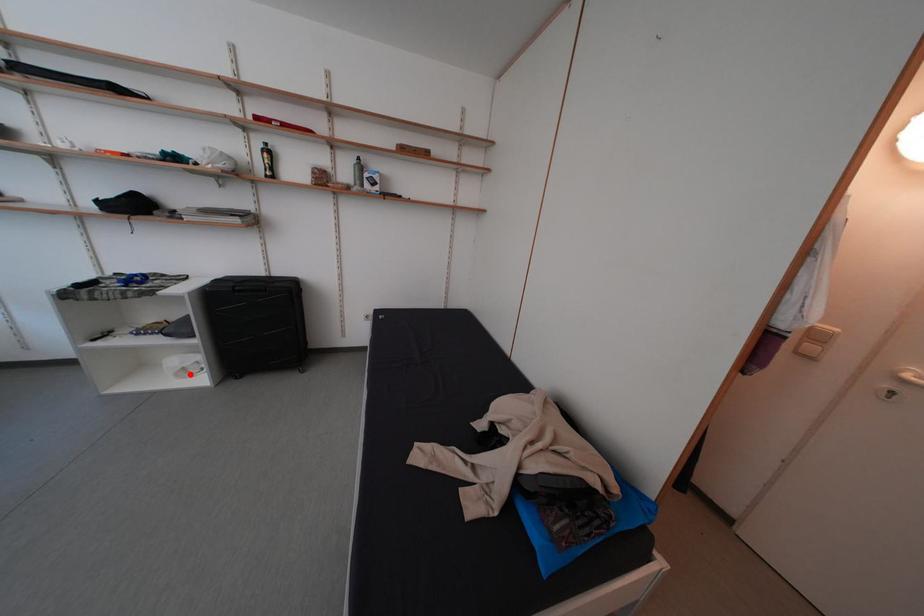
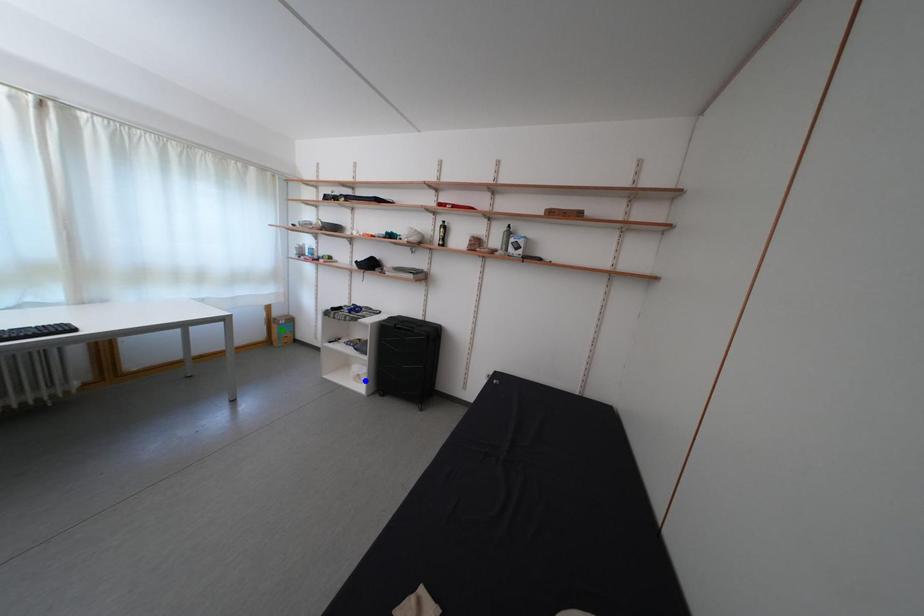
Question: I am providing you with two images of the same scene from different viewpoints. A red point is marked on the first image. You are given multiple points on the second image. Which point in image 2 is actually the same real-world point as the red point in image 1?

Choices:
 (A) blue point
 (B) yellow point
 (C) green point

Answer: (A)